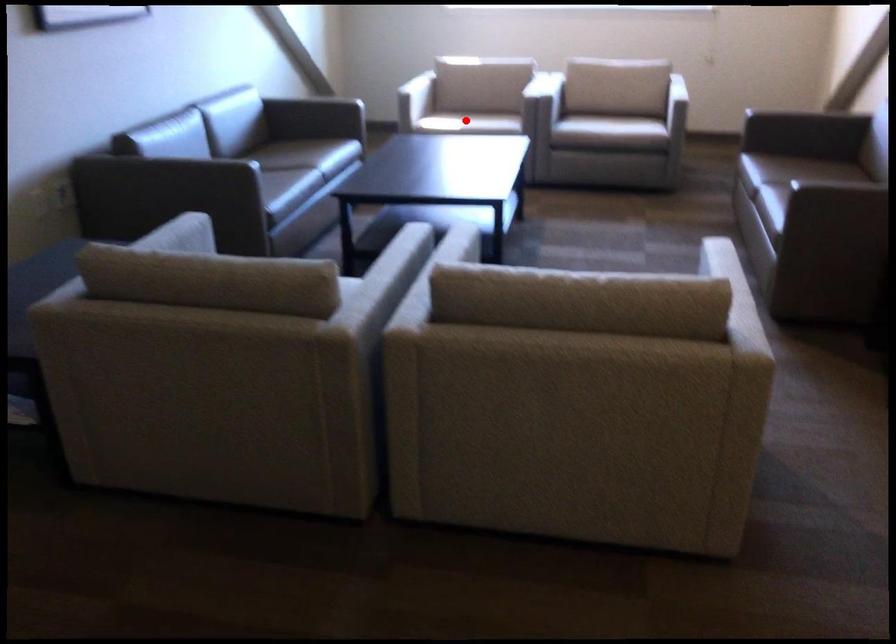
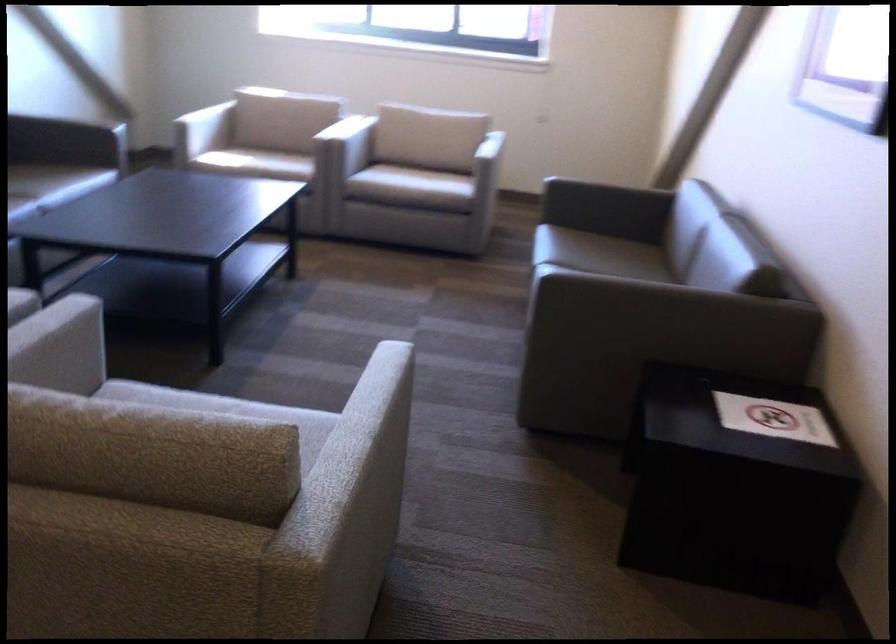
Question: I am providing you with two images of the same scene from different viewpoints. Given a red point in image1, look at the same physical point in image2. Is it:

Choices:
 (A) Closer to the viewpoint
 (B) Farther from the viewpoint

Answer: (A)